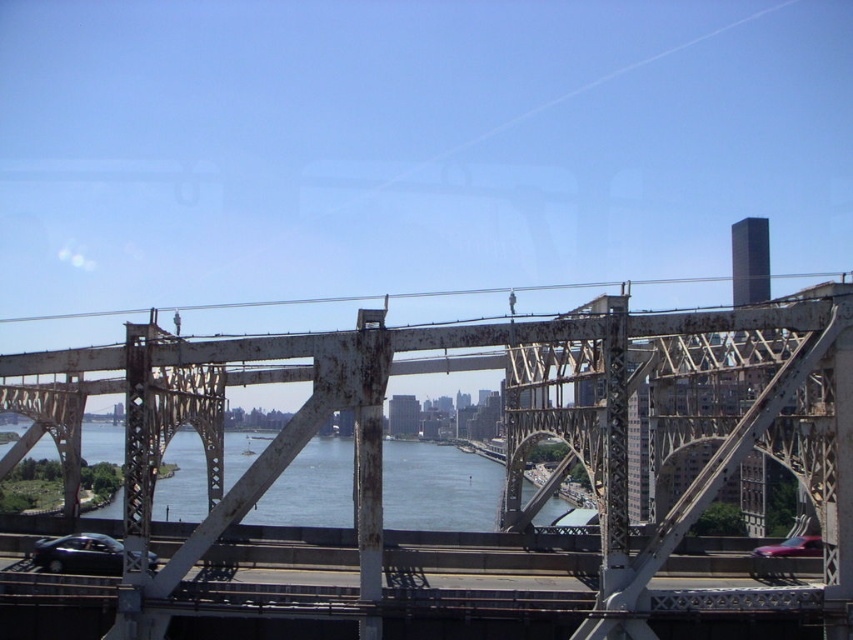
Looking at this image, is the position of rusty metal bridge at center more distant than that of blue water at center?

No, it is not.

Which is above, rusty metal bridge at center or blue water at center?

rusty metal bridge at center

Which is behind, point (718, 337) or point (239, 474)?

The point (239, 474) is behind.

I want to click on rusty metal bridge at center, so click(x=521, y=440).

Who is taller, rusty metal bridge at center or shiny black car at lower left?

Standing taller between the two is rusty metal bridge at center.

Who is positioned more to the left, rusty metal bridge at center or shiny black car at lower left?

From the viewer's perspective, shiny black car at lower left appears more on the left side.

Between point (779, 376) and point (38, 554), which one is positioned behind?

Positioned behind is point (38, 554).

Find the location of `rusty metal bridge at center`. rusty metal bridge at center is located at coordinates (521, 440).

Who is higher up, shiny black car at lower left or shiny red car at lower right?

shiny black car at lower left is higher up.

Is point (119, 556) less distant than point (798, 545)?

That is True.

Between point (115, 552) and point (791, 547), which one is positioned behind?

Positioned behind is point (791, 547).

The width and height of the screenshot is (853, 640). Find the location of `shiny black car at lower left`. shiny black car at lower left is located at coordinates (78, 554).